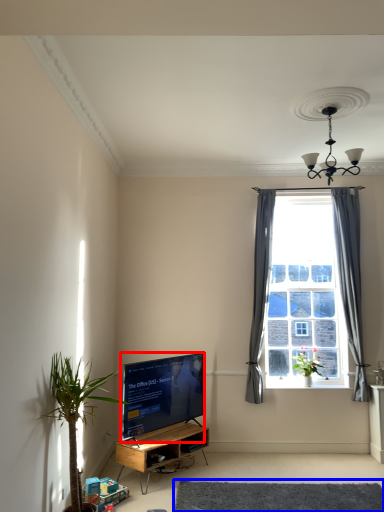
Question: Which point is further to the camera, television (highlighted by a red box) or plain (highlighted by a blue box)?

Choices:
 (A) television
 (B) plain

Answer: (A)